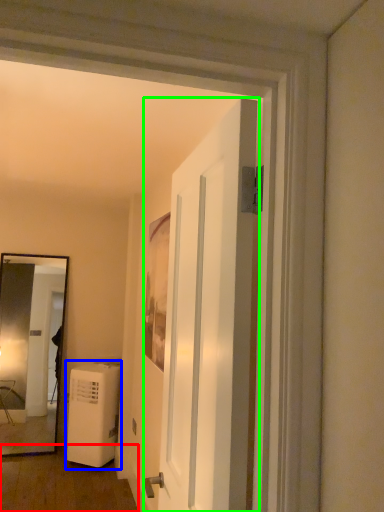
Question: Which object is positioned closest to corridor (highlighted by a red box)? Select from air conditioner (highlighted by a blue box) and door (highlighted by a green box).

Choices:
 (A) air conditioner
 (B) door

Answer: (A)